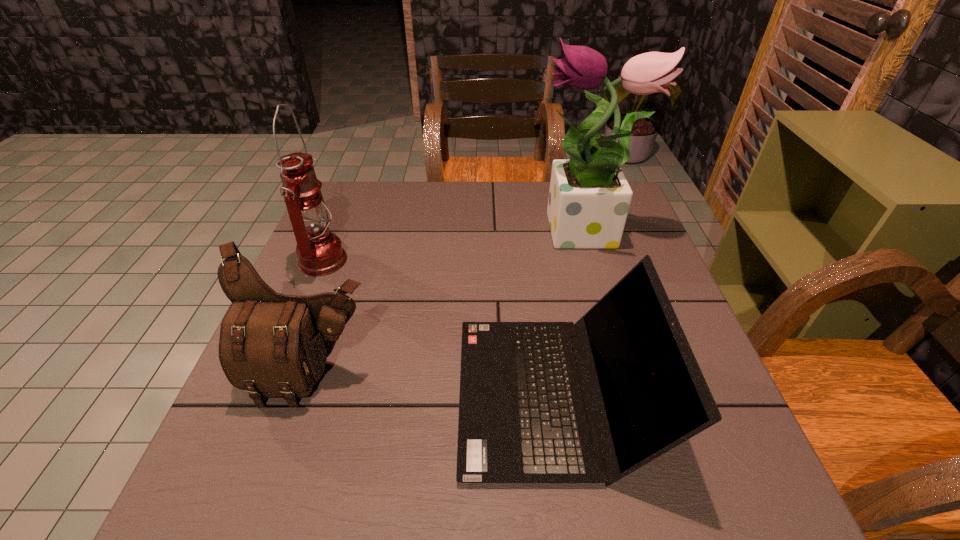
The height and width of the screenshot is (540, 960). In order to click on flower arrangement in this screenshot , I will do `click(589, 198)`.

You are a GUI agent. You are given a task and a screenshot of the screen. Output one action in this format:
    pyautogui.click(x=<x>, y=<y>)
    Task: Click on the second tallest object
    
    Given the screenshot: What is the action you would take?
    pyautogui.click(x=319, y=251)

This screenshot has width=960, height=540. I want to click on shoulder bag, so click(x=271, y=345).

Identify the location of laptop computer. coord(524,412).

Where is `vacant space located 0.170m on the front-facing side of the tallest object`? This screenshot has width=960, height=540. vacant space located 0.170m on the front-facing side of the tallest object is located at coordinates (474, 234).

Where is `free space located 0.350m on the front-facing side of the tallest object`? The height and width of the screenshot is (540, 960). free space located 0.350m on the front-facing side of the tallest object is located at coordinates (408, 234).

Locate an element on the screen. free region located on the front-facing side of the tallest object is located at coordinates (467, 234).

Where is `blank space located 0.060m on the back of the oil lamp`? Image resolution: width=960 pixels, height=540 pixels. blank space located 0.060m on the back of the oil lamp is located at coordinates (337, 227).

Where is `free space located 0.050m on the front-facing side of the second shortest object`? free space located 0.050m on the front-facing side of the second shortest object is located at coordinates (293, 435).

Locate an element on the screen. vacant space positioned on the screen of the laptop computer is located at coordinates tap(258, 395).